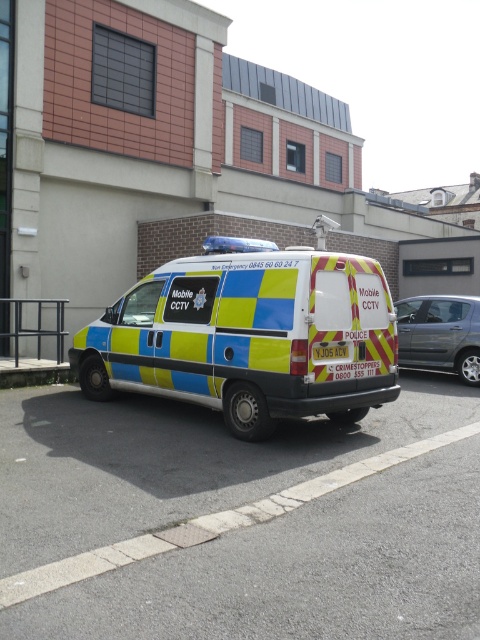
Who is more distant from viewer, (247, 241) or (470, 352)?

The point (470, 352) is more distant.

Is yellow and blue checkered van at center smaller than metallic silver car at right?

Incorrect, yellow and blue checkered van at center is not smaller in size than metallic silver car at right.

Does point (181, 285) come farther from viewer compared to point (459, 314)?

That is False.

Where is `yellow and blue checkered van at center`? yellow and blue checkered van at center is located at coordinates (250, 336).